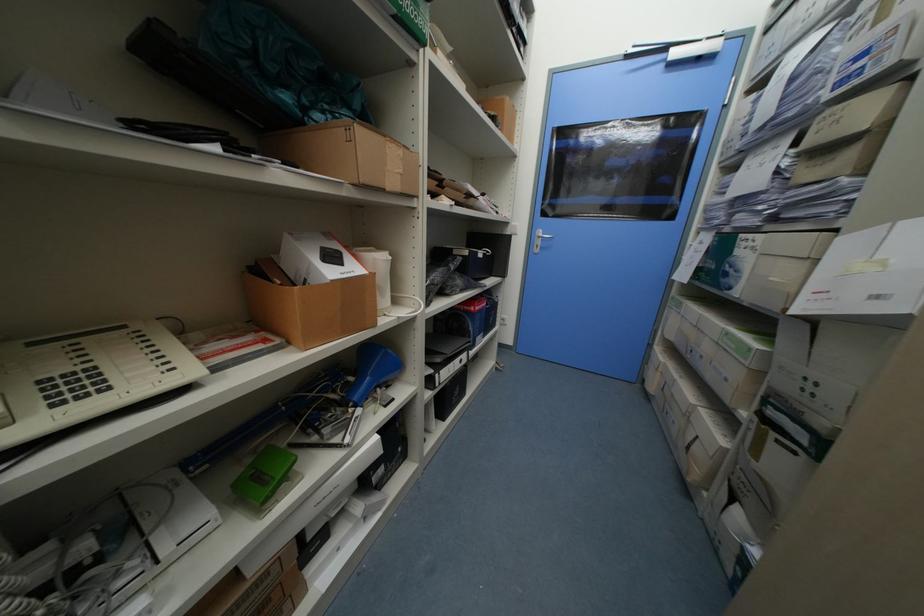
The width and height of the screenshot is (924, 616). Describe the element at coordinates (74, 371) in the screenshot. I see `the white phone button` at that location.